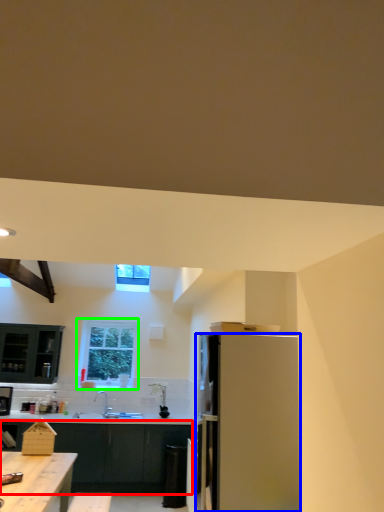
Question: Based on their relative distances, which object is nearer to cabinetry (highlighted by a red box)? Choose from refrigerator (highlighted by a blue box) and window (highlighted by a green box).

Choices:
 (A) refrigerator
 (B) window

Answer: (B)